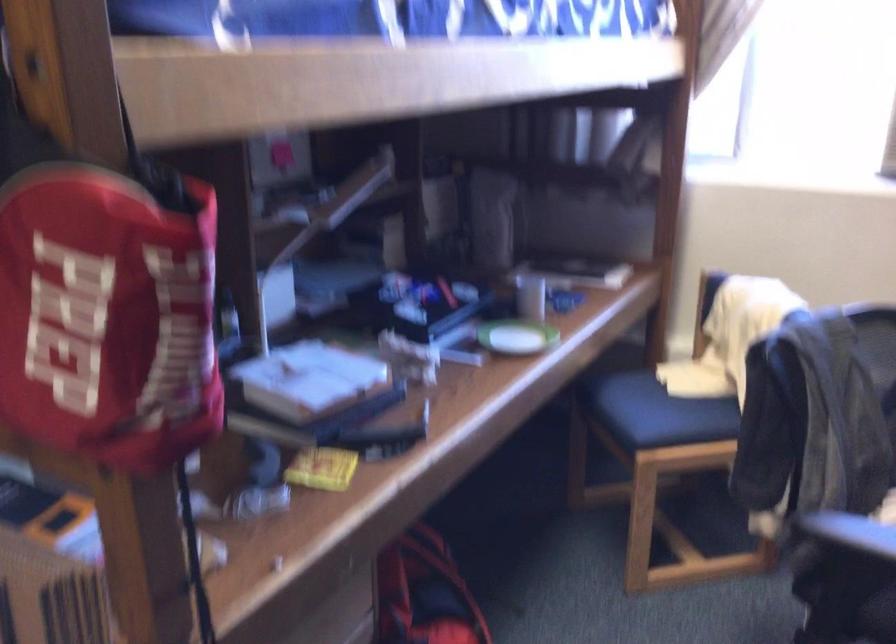
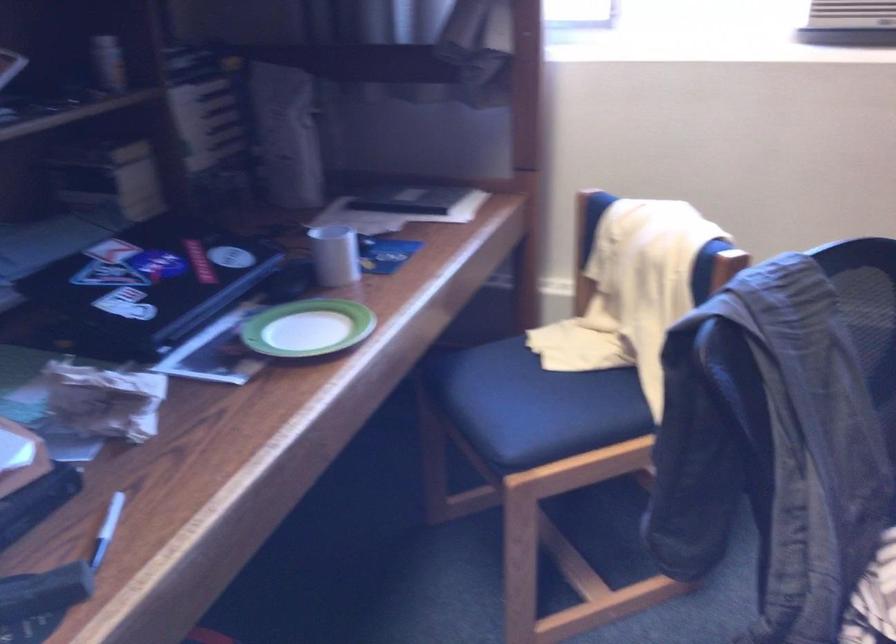
Where in the second image is the point corresponding to point 524,297 from the first image?

(334, 254)